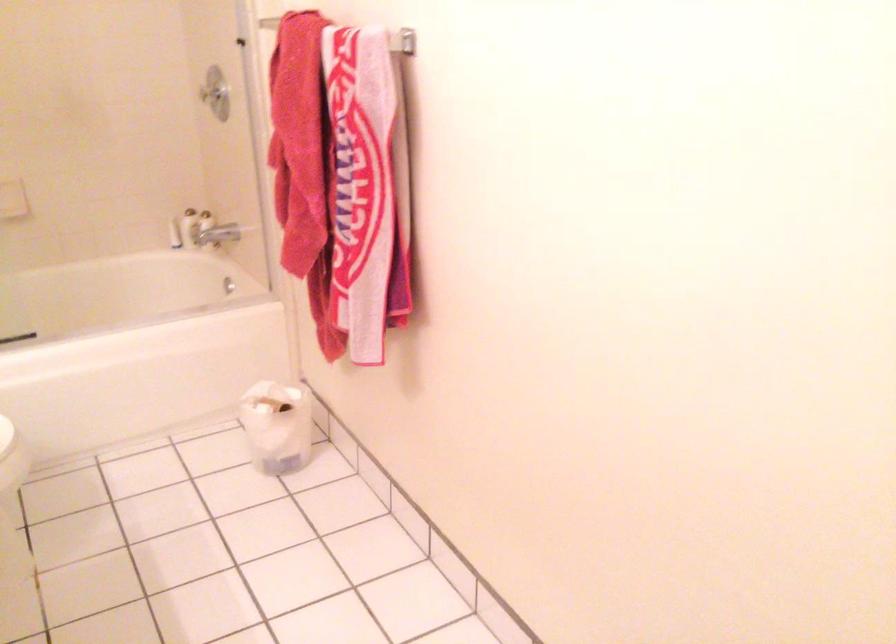
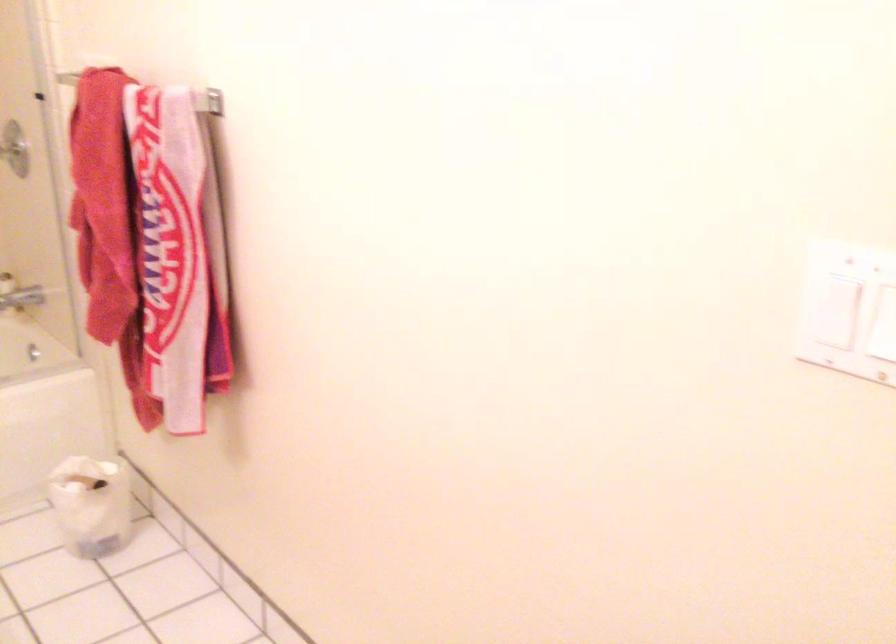
Locate, in the second image, the point that corresponds to point (276, 428) in the first image.

(90, 505)